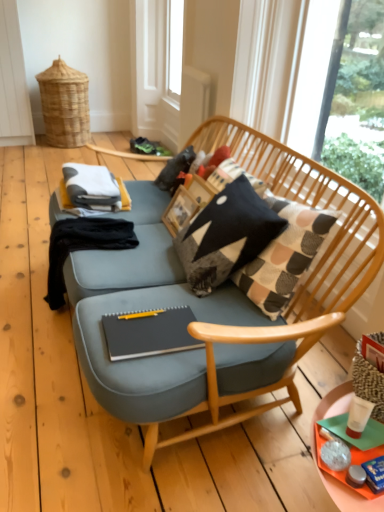
Question: In the image, is transparent plastic screen door at upper center positioned in front of or behind transparent glass window at upper right?

Choices:
 (A) front
 (B) behind

Answer: (B)

Question: Is transparent plastic screen door at upper center situated inside transparent glass window at upper right or outside?

Choices:
 (A) inside
 (B) outside

Answer: (B)

Question: Based on their relative distances, which object is nearer to the knitted fabric pillow at center?

Choices:
 (A) matte black notebook at center
 (B) transparent plastic screen door at upper center
 (C) orange plastic tray at lower right
 (D) black fabric at left
 (E) transparent glass window at upper right

Answer: (A)

Question: Which object is the closest to the transparent plastic screen door at upper center?

Choices:
 (A) orange plastic tray at lower right
 (B) black fabric at left
 (C) knitted fabric pillow at center
 (D) matte black notebook at center
 (E) transparent glass window at upper right

Answer: (E)